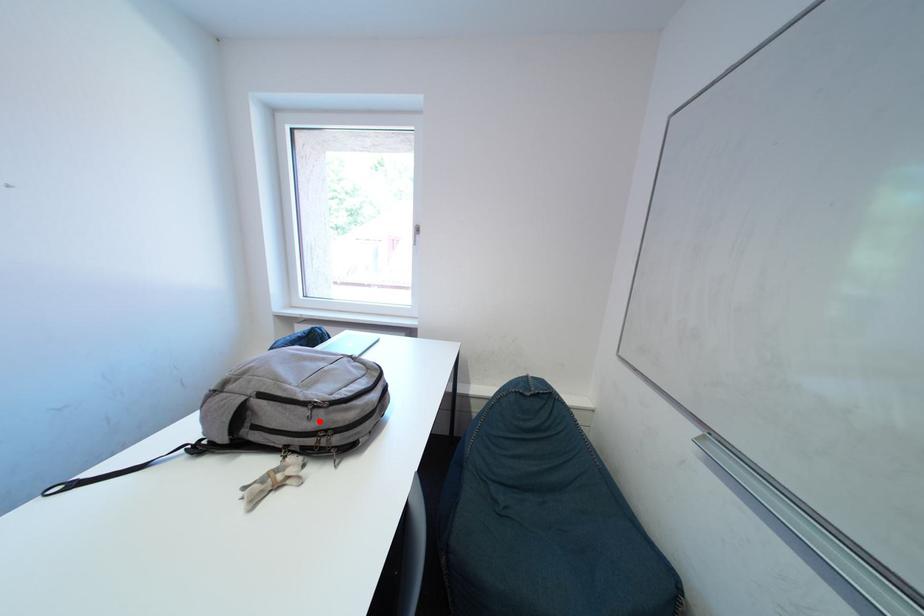
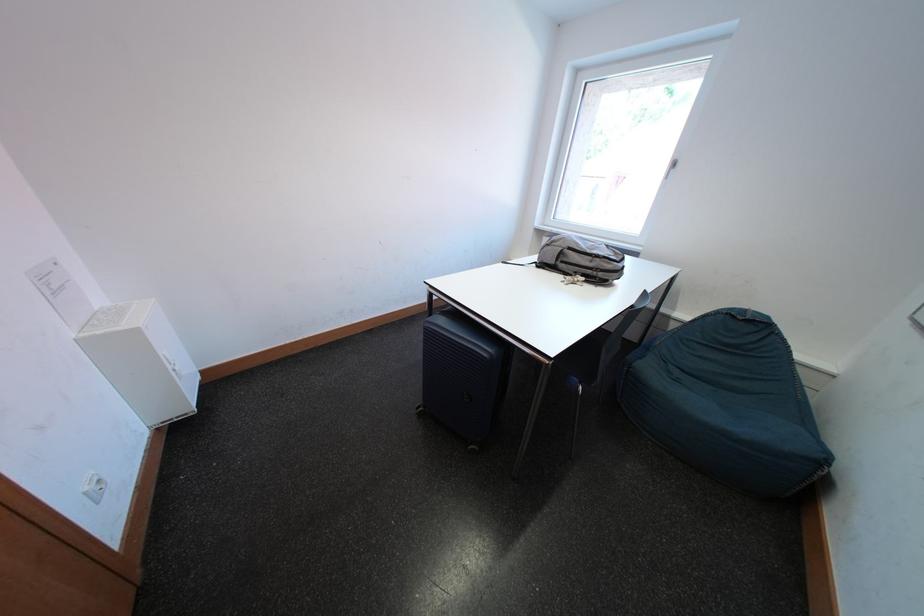
Question: I am providing you with two images of the same scene from different viewpoints. Image1 has a red point marked. In image2, the corresponding 3D location appears at what relative position? Reply with the corresponding letter.

Choices:
 (A) Closer
 (B) Farther

Answer: (A)